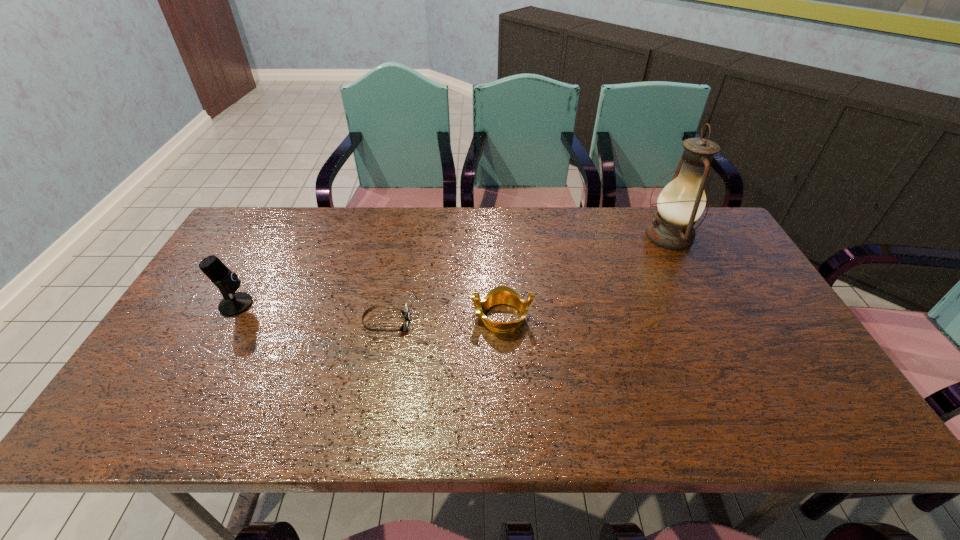
This screenshot has width=960, height=540. In order to click on vacant position at the left edge of the desktop in this screenshot , I will do `click(209, 322)`.

At what (x,y) coordinates should I click in order to perform the action: click on vacant space at the right edge of the desktop. Please return your answer as a coordinate pair (x, y). This screenshot has width=960, height=540. Looking at the image, I should click on (728, 254).

This screenshot has height=540, width=960. In the image, there is a desktop. Find the location of `vacant space at the far left corner`. vacant space at the far left corner is located at coordinates (241, 243).

Identify the location of free space at the far right corner of the desktop. The image size is (960, 540). (691, 252).

I want to click on vacant space that is in between the farthest object and the second tallest object, so click(452, 271).

Locate an element on the screen. The height and width of the screenshot is (540, 960). free spot between the farthest object and the second shortest object is located at coordinates (586, 276).

Where is `empty space between the leftmost object and the tallest object`? Image resolution: width=960 pixels, height=540 pixels. empty space between the leftmost object and the tallest object is located at coordinates (452, 271).

Where is `vacant point located between the third object from left to right and the tallest object`? This screenshot has width=960, height=540. vacant point located between the third object from left to right and the tallest object is located at coordinates (586, 276).

Identify the location of free spot between the tiara and the goggles. Image resolution: width=960 pixels, height=540 pixels. (444, 320).

This screenshot has width=960, height=540. I want to click on free point between the farthest object and the second object from left to right, so click(x=528, y=280).